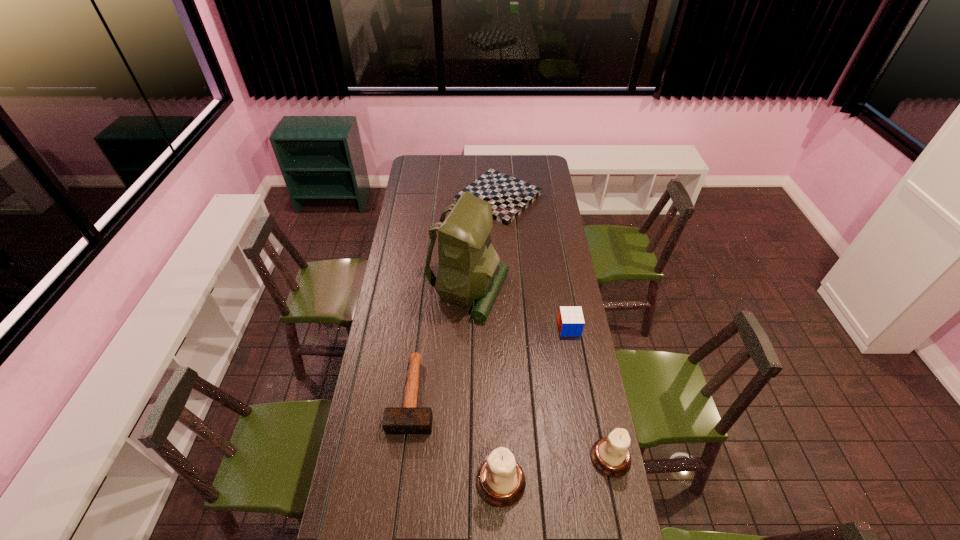
Find the location of `free point located on the right of the fifth shortest object`. free point located on the right of the fifth shortest object is located at coordinates (600, 482).

The height and width of the screenshot is (540, 960). I want to click on vacant space situated on the left of the shorter candle holder, so click(x=567, y=458).

Locate an element on the screen. Image resolution: width=960 pixels, height=540 pixels. vacant space situated on the back of the checkerboard is located at coordinates (496, 163).

Locate an element on the screen. The height and width of the screenshot is (540, 960). free location located 0.270m on the front of the backpack with visible pockets is located at coordinates (566, 292).

You are a GUI agent. You are given a task and a screenshot of the screen. Output one action in this format:
    pyautogui.click(x=<x>, y=<y>)
    Task: Click on the free spot located on the left of the fourth tallest object
    
    Given the screenshot: What is the action you would take?
    pyautogui.click(x=519, y=328)

This screenshot has height=540, width=960. I want to click on vacant space located 0.090m on the hammer head face of the second shortest object, so click(x=405, y=460).

Identify the location of object at the far edge. Image resolution: width=960 pixels, height=540 pixels. (509, 197).

At what (x,y) coordinates should I click in order to perform the action: click on object at the near edge. Please return your answer as a coordinate pair (x, y). The image size is (960, 540). Looking at the image, I should click on (500, 481).

Identify the location of object that is positioned at the left edge. (409, 419).

Where is `candle holder that is at the right edge`? The width and height of the screenshot is (960, 540). candle holder that is at the right edge is located at coordinates (610, 455).